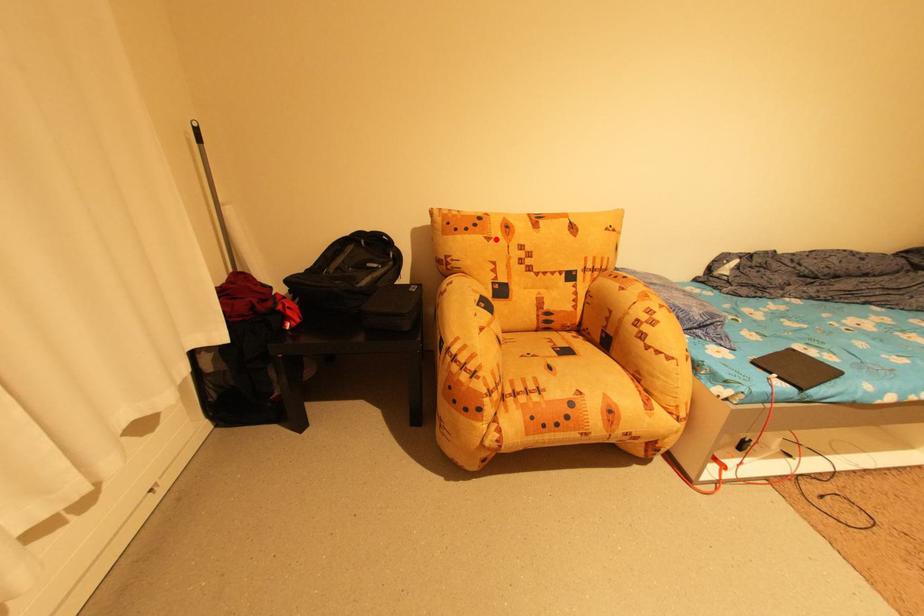
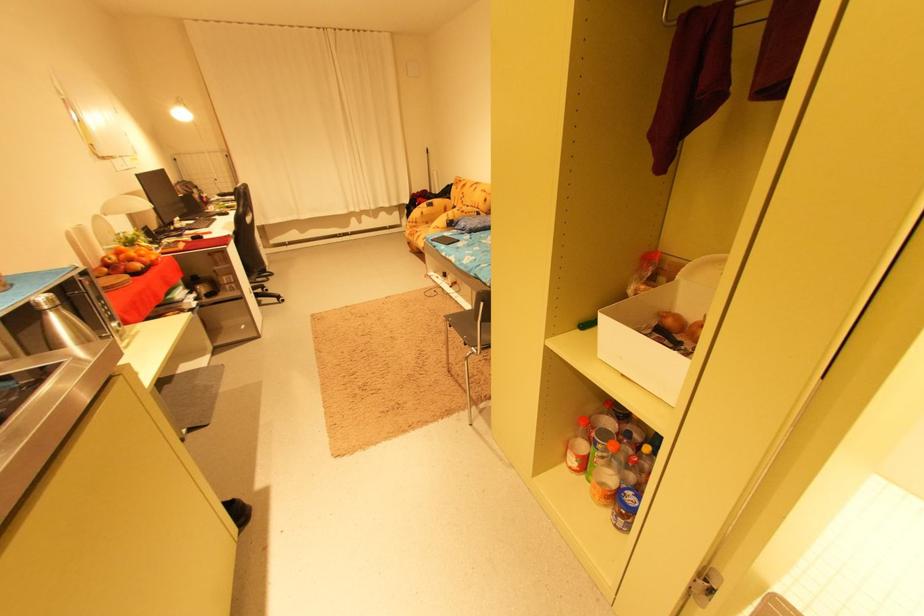
Locate, in the second image, the point that corresponds to the highlighted location in the first image.

(464, 188)